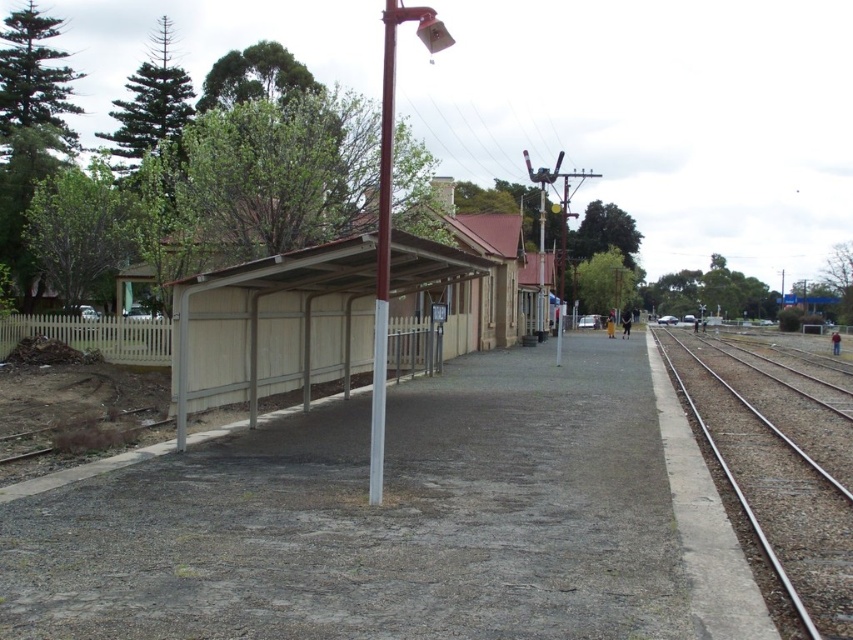
Question: Which of the following is the farthest from the observer?

Choices:
 (A) metal/smooth train track at right
 (B) white glossy pole at center
 (C) metallic pole at center

Answer: (C)

Question: Can you confirm if white glossy pole at center is bigger than metallic pole at center?

Choices:
 (A) yes
 (B) no

Answer: (B)

Question: Which of the following is the farthest from the observer?

Choices:
 (A) white glossy pole at center
 (B) metallic pole at center

Answer: (B)

Question: Does white glossy pole at center have a smaller size compared to metallic pole at center?

Choices:
 (A) yes
 (B) no

Answer: (A)

Question: Can you confirm if metal/smooth train track at right is positioned below white glossy pole at center?

Choices:
 (A) yes
 (B) no

Answer: (A)

Question: Considering the real-world distances, which object is closest to the metal/smooth train track at right?

Choices:
 (A) metallic pole at center
 (B) white glossy pole at center

Answer: (B)